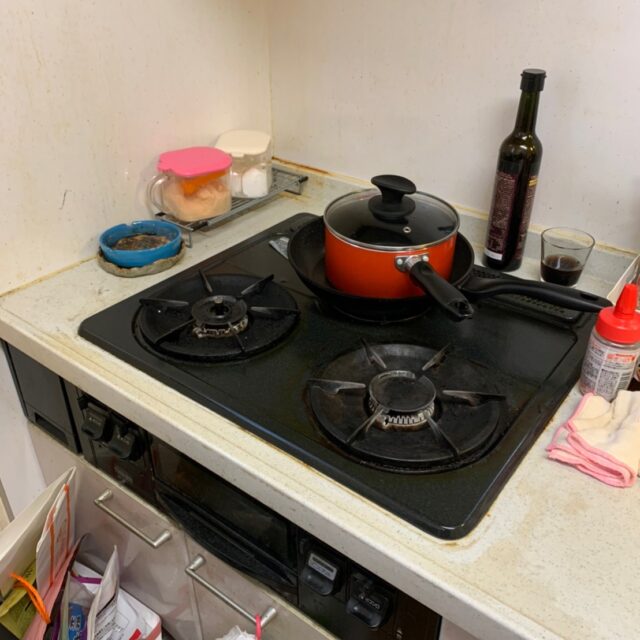
Identify the location of dish clothe. The height and width of the screenshot is (640, 640). (582, 431).